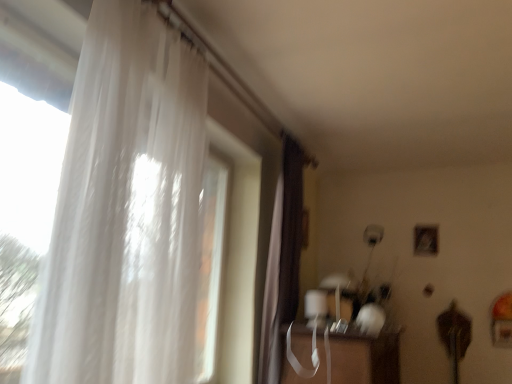
Question: Are brown velvet curtain at center, arranged as the second curtain when viewed from the left, and transparent plastic table at lower center making contact?

Choices:
 (A) yes
 (B) no

Answer: (B)

Question: Is transparent plastic table at lower center at the back of brown velvet curtain at center, arranged as the second curtain when viewed from the left?

Choices:
 (A) yes
 (B) no

Answer: (B)

Question: Can you confirm if brown velvet curtain at center, positioned as the 2th curtain in front-to-back order, is bigger than transparent plastic table at lower center?

Choices:
 (A) no
 (B) yes

Answer: (A)

Question: Does brown velvet curtain at center, arranged as the second curtain when viewed from the left, have a lesser height compared to transparent plastic table at lower center?

Choices:
 (A) yes
 (B) no

Answer: (B)

Question: Does brown velvet curtain at center, positioned as the 2th curtain in front-to-back order, contain transparent plastic table at lower center?

Choices:
 (A) yes
 (B) no

Answer: (B)

Question: Is brown velvet curtain at center, arranged as the second curtain when viewed from the left, at the right side of transparent plastic table at lower center?

Choices:
 (A) yes
 (B) no

Answer: (B)

Question: Is there a large distance between transparent plastic table at lower center and brown velvet curtain at center, which is the 1th curtain in right-to-left order?

Choices:
 (A) yes
 (B) no

Answer: (B)

Question: Does transparent plastic table at lower center turn towards brown velvet curtain at center, which is the 1th curtain in right-to-left order?

Choices:
 (A) yes
 (B) no

Answer: (B)

Question: From the image's perspective, is transparent plastic table at lower center on brown velvet curtain at center, which is the 1th curtain in back-to-front order?

Choices:
 (A) yes
 (B) no

Answer: (B)

Question: Is transparent plastic table at lower center smaller than brown velvet curtain at center, positioned as the 2th curtain in front-to-back order?

Choices:
 (A) yes
 (B) no

Answer: (B)

Question: Can you confirm if transparent plastic table at lower center is shorter than brown velvet curtain at center, which is the 1th curtain in right-to-left order?

Choices:
 (A) yes
 (B) no

Answer: (A)

Question: Considering the relative sizes of transparent plastic table at lower center and brown velvet curtain at center, positioned as the 2th curtain in front-to-back order, in the image provided, is transparent plastic table at lower center thinner than brown velvet curtain at center, positioned as the 2th curtain in front-to-back order,?

Choices:
 (A) no
 (B) yes

Answer: (A)

Question: Is transparent plastic table at lower center completely or partially inside translucent white curtain at left, marked as the first curtain in a left-to-right arrangement?

Choices:
 (A) no
 (B) yes

Answer: (A)